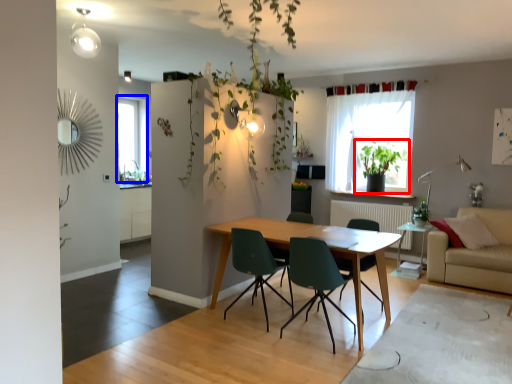
Question: Among these objects, which one is farthest to the camera, houseplant (highlighted by a red box) or window (highlighted by a blue box)?

Choices:
 (A) houseplant
 (B) window

Answer: (B)